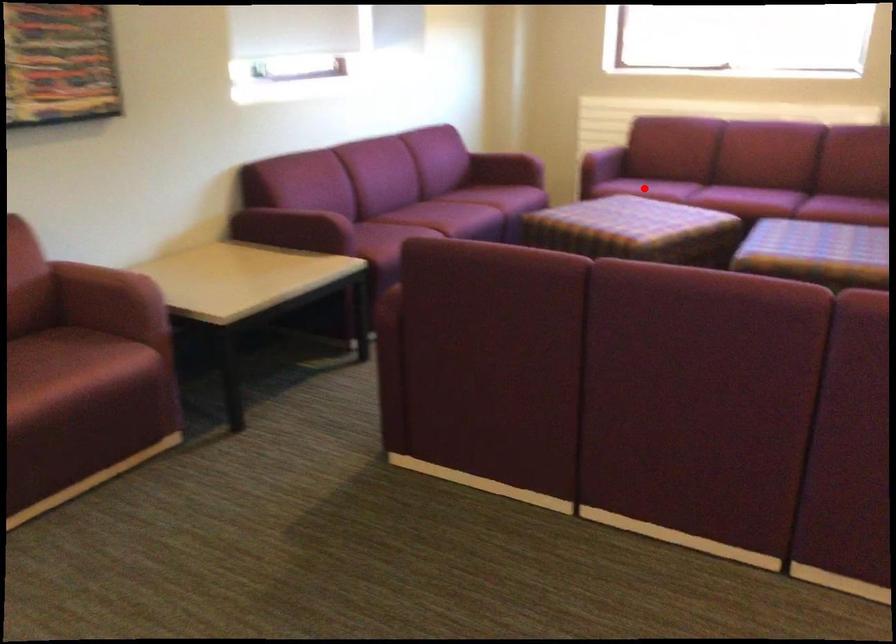
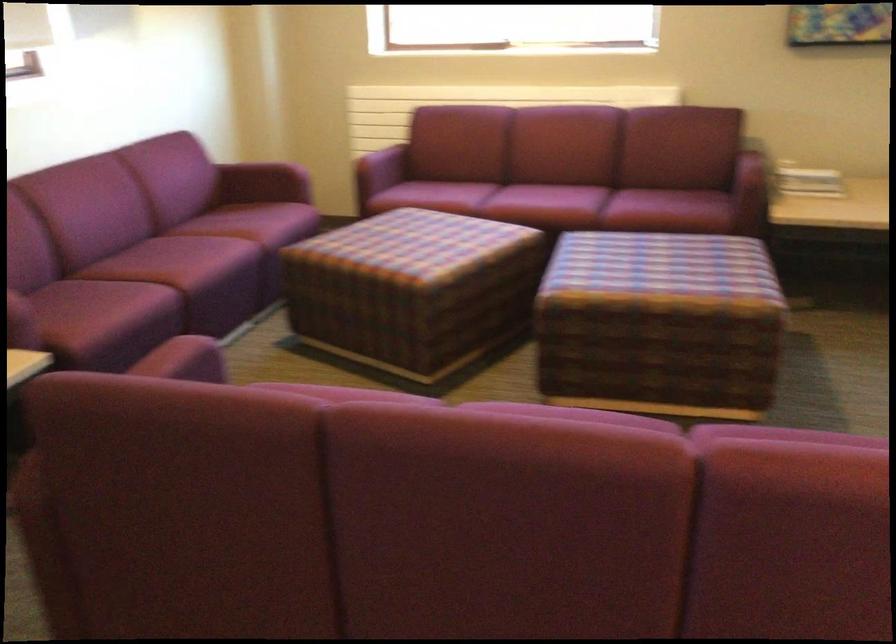
The point at the highlighted location is marked in the first image. Where is the corresponding point in the second image?

(432, 196)